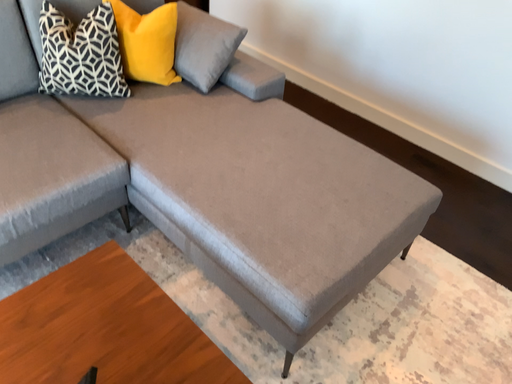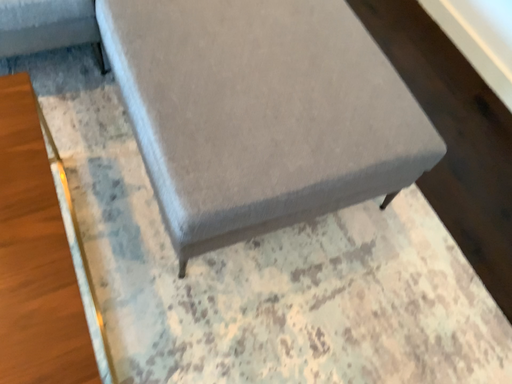
Question: How did the camera likely rotate when shooting the video?

Choices:
 (A) rotated downward
 (B) rotated upward

Answer: (A)